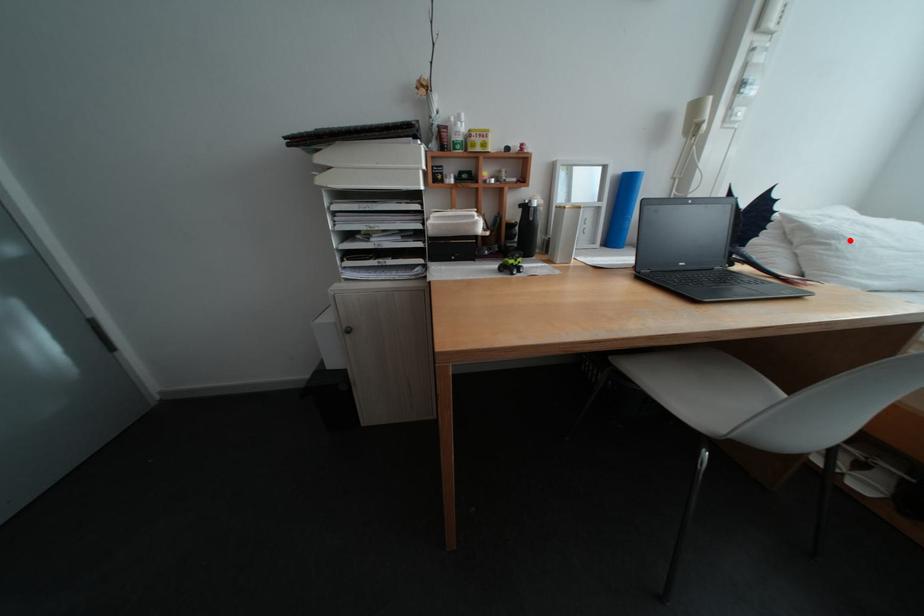
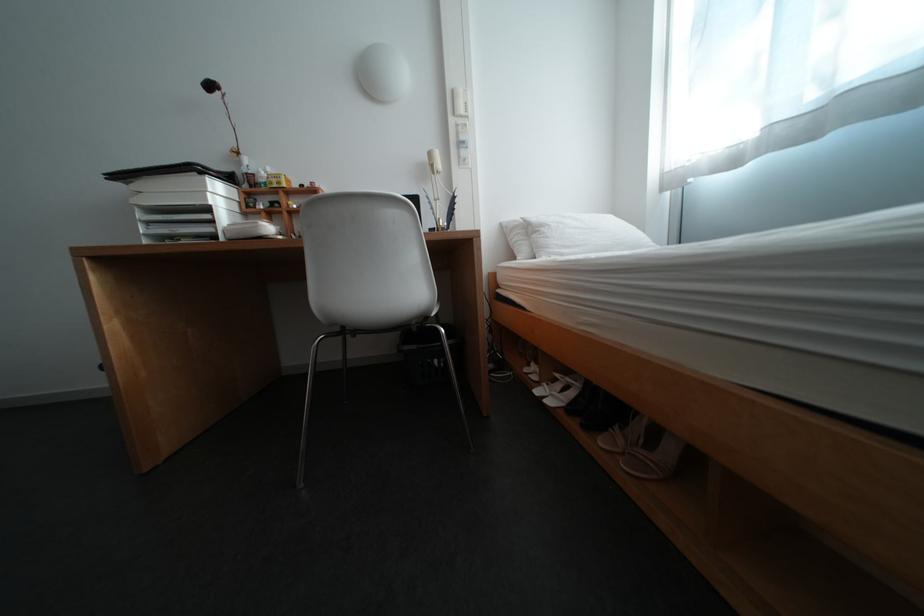
Find the pixel in the second image that matches the highlighted location in the first image.

(555, 228)